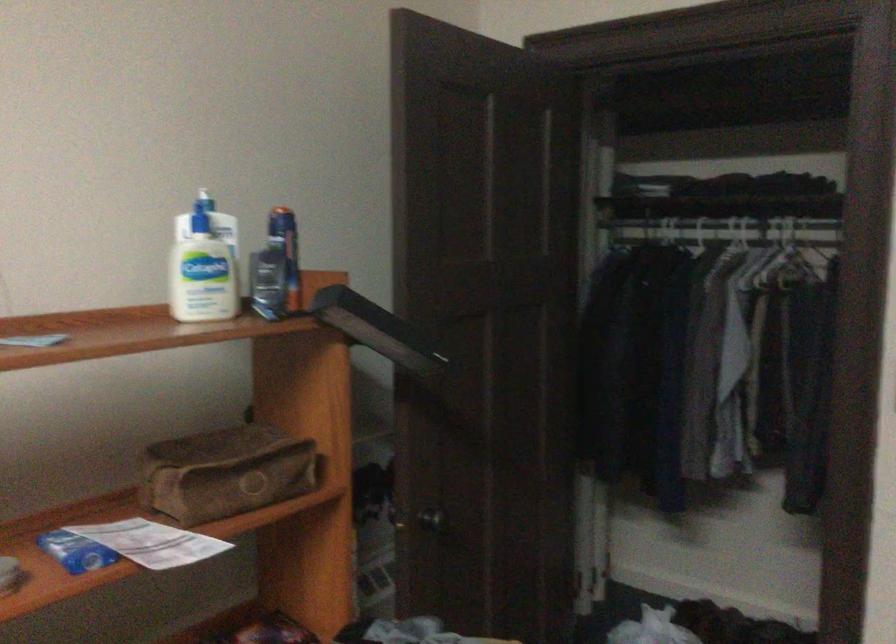
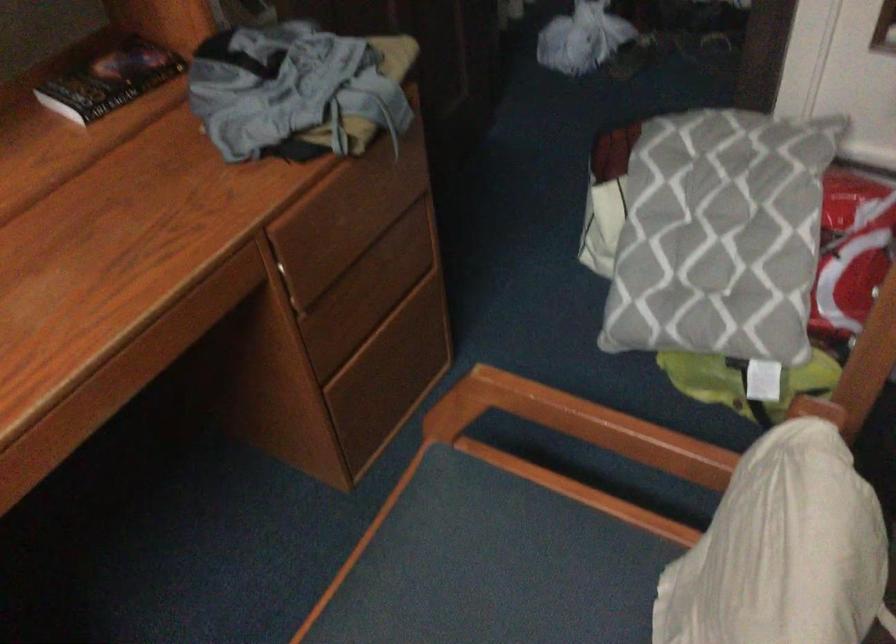
Question: Based on the continuous images, in which direction is the camera rotating? Reply with the corresponding letter.

Choices:
 (A) Left
 (B) Right
 (C) Up
 (D) Down

Answer: (D)